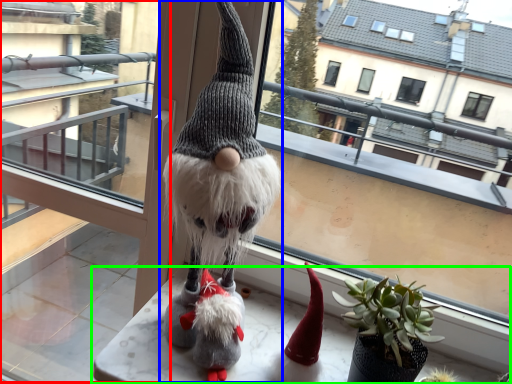
Question: Which is farther away from glass door (highlighted by a red box)? figurine (highlighted by a blue box) or table (highlighted by a green box)?

Choices:
 (A) figurine
 (B) table

Answer: (A)